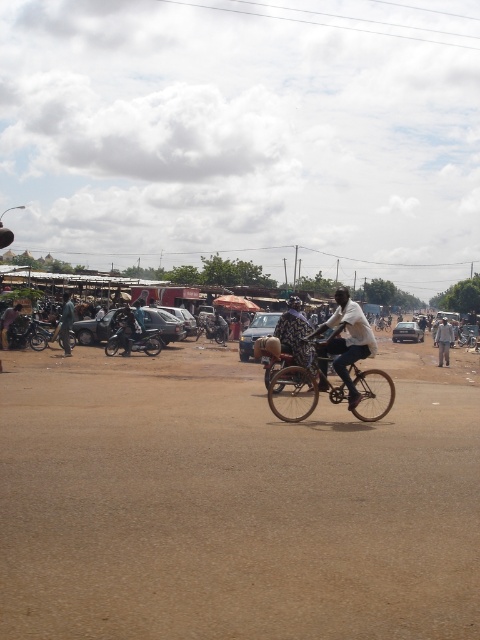
Is metallic silver bicycle at center to the left of dark brown leather bicycle at center from the viewer's perspective?

Correct, you'll find metallic silver bicycle at center to the left of dark brown leather bicycle at center.

Between point (380, 376) and point (322, 362), which one is positioned in front?

Point (380, 376)

Does point (274, 404) come farther from viewer compared to point (322, 368)?

No.

Where is `metallic silver bicycle at center`? metallic silver bicycle at center is located at coordinates (294, 392).

The image size is (480, 640). What do you see at coordinates (235, 500) in the screenshot?
I see `brown dirt field at center` at bounding box center [235, 500].

Can you confirm if brown dirt field at center is thinner than shiny black motorcycle at center-left?

Incorrect, brown dirt field at center's width is not less than shiny black motorcycle at center-left's.

At what (x,y) coordinates should I click in order to perform the action: click on brown dirt field at center. Please return your answer as a coordinate pair (x, y). Looking at the image, I should click on (235, 500).

Based on the photo, is dark brown leather bicycle at center to the left of dark gray fabric pants at right from the viewer's perspective?

Correct, you'll find dark brown leather bicycle at center to the left of dark gray fabric pants at right.

Describe the element at coordinates (347, 340) in the screenshot. I see `dark brown leather bicycle at center` at that location.

Which is behind, point (307, 336) or point (434, 340)?

Positioned behind is point (434, 340).

The width and height of the screenshot is (480, 640). Find the location of `dark brown leather bicycle at center`. dark brown leather bicycle at center is located at coordinates (347, 340).